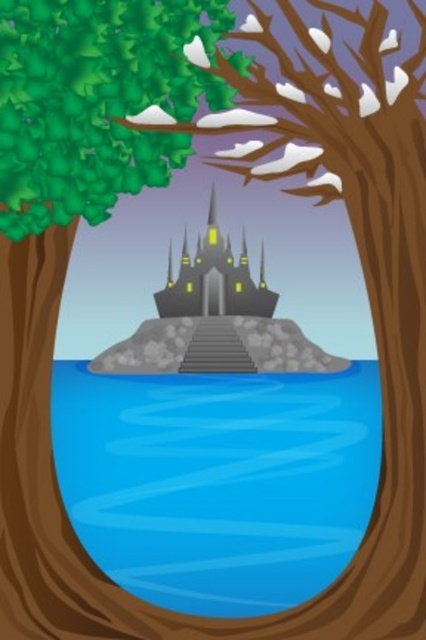
You are standing inside the tree looking through the circular window. There are two points marked in the scene. The first point is at coordinate (65,371) and the second point is at (187,317). Which point is closer to you?

Point (65,371) is further to the camera than point (187,317), so the closer point to you is point (187,317).

You are standing inside a tree looking through a circular window. There is a point marked at coordinates (195, 428) in the scene. If you want to touch that point with a stick that is 15 meters long, will the stick reach it?

The point at coordinates (195, 428) is 14.34 meters away from the viewer. Since the stick is 15 meters long, it will reach the point.

You are an architect designing a model of this scene. The circular window frame is 1 meter in diameter. If you want to maintain the proportions seen in the image, which object should you make larger when constructing the model, the blue water at center or the dark gray stone castle at center?

The dark gray stone castle at center occupies more space in the image than the blue water at center. To maintain proportions, the castle should be made larger in the model compared to the water.